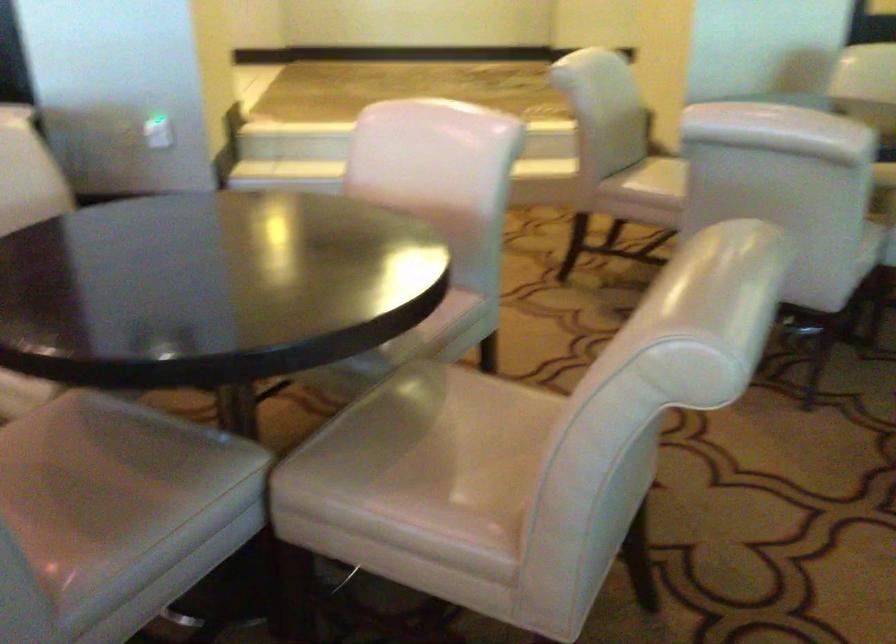
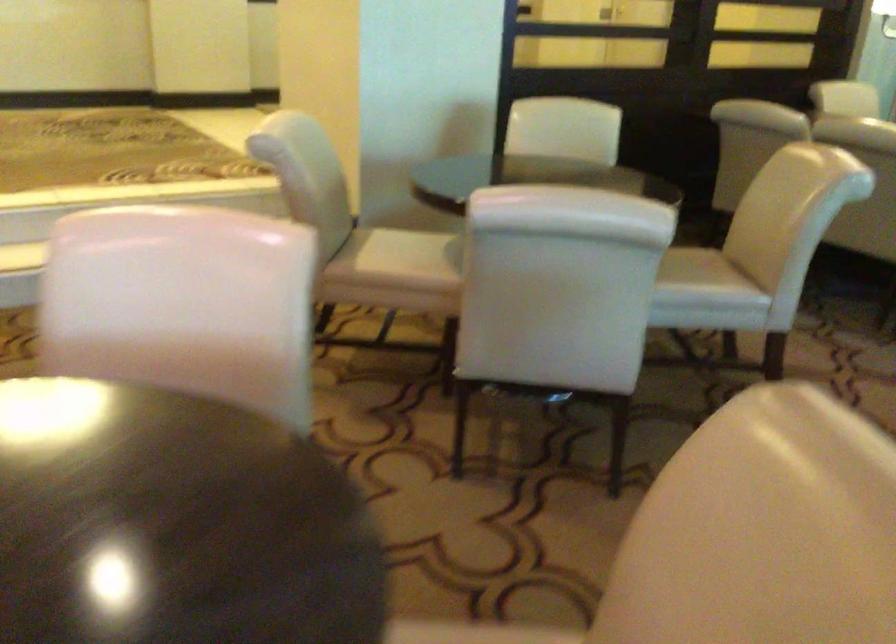
Question: The first image is from the beginning of the video and the second image is from the end. How did the camera likely rotate when shooting the video?

Choices:
 (A) Left
 (B) Right
 (C) Up
 (D) Down

Answer: (B)